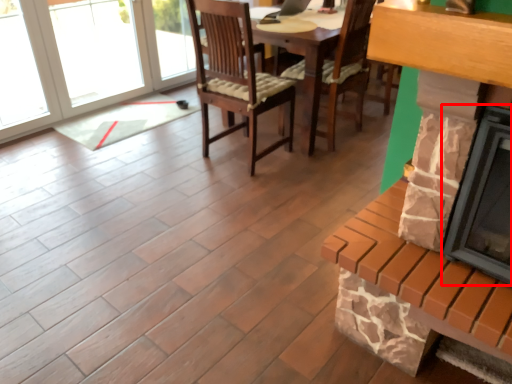
Question: In this image, where is fireplace (annotated by the red box) located relative to fireplace?

Choices:
 (A) left
 (B) right

Answer: (B)